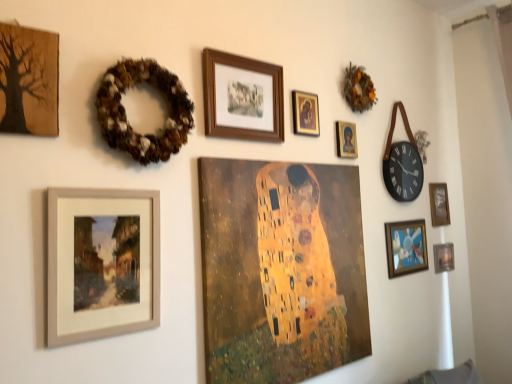
Question: Would you say wooden textured tree at upper left, marked as the 1th picture frame in a left-to-right arrangement, is to the left or to the right of matte wooden frame at lower left, which appears as the 8th picture frame when viewed from the right, in the picture?

Choices:
 (A) left
 (B) right

Answer: (A)

Question: From a real-world perspective, is wooden textured tree at upper left, acting as the 9th picture frame starting from the right, above or below matte wooden frame at lower left, which appears as the 8th picture frame when viewed from the right?

Choices:
 (A) below
 (B) above

Answer: (B)

Question: Estimate the real-world distances between objects in this image. Which object is closer to the gold textured canvas at center, the fourth picture frame positioned from the left?

Choices:
 (A) gold-framed portrait at upper center, which is the fifth picture frame in left-to-right order
 (B) brown textured wreath at upper right, acting as the 1th decor starting from the top
 (C) wooden frame at upper center, the 7th picture frame in the right-to-left sequence
 (D) black leather wall clock at upper right
 (E) metallic silver picture frame at lower right, arranged as the 9th picture frame when viewed from the left

Answer: (C)

Question: Estimate the real-world distances between objects in this image. Which object is farther from the gold textured canvas at center, the 6th picture frame in the right-to-left sequence?

Choices:
 (A) wooden frame at right, the eighth picture frame viewed from the left
 (B) wooden frame at upper center, the 7th picture frame in the right-to-left sequence
 (C) metallic silver picture frame at lower right, arranged as the 9th picture frame when viewed from the left
 (D) wooden textured tree at upper left, acting as the 9th picture frame starting from the right
 (E) brown textured wreath at upper left, arranged as the second decor when viewed from the right

Answer: (A)